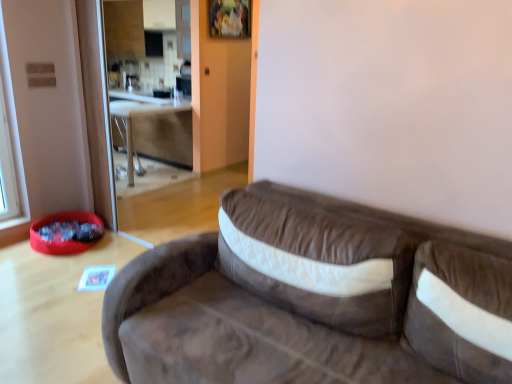
Question: From a real-world perspective, is brown suede studio couch at center on wooden table at center?

Choices:
 (A) no
 (B) yes

Answer: (B)

Question: Is brown suede studio couch at center turned away from wooden table at center?

Choices:
 (A) no
 (B) yes

Answer: (A)

Question: Does brown suede studio couch at center lie behind wooden table at center?

Choices:
 (A) yes
 (B) no

Answer: (B)

Question: Is brown suede studio couch at center closer to camera compared to wooden table at center?

Choices:
 (A) yes
 (B) no

Answer: (A)

Question: Is brown suede studio couch at center positioned far away from wooden table at center?

Choices:
 (A) yes
 (B) no

Answer: (A)

Question: Considering the relative sizes of brown suede studio couch at center and wooden table at center in the image provided, is brown suede studio couch at center thinner than wooden table at center?

Choices:
 (A) no
 (B) yes

Answer: (A)

Question: From the image's perspective, does wooden table at center appear higher than brown suede studio couch at center?

Choices:
 (A) yes
 (B) no

Answer: (A)

Question: Does wooden table at center have a greater width compared to brown suede studio couch at center?

Choices:
 (A) yes
 (B) no

Answer: (B)

Question: Is wooden table at center bigger than brown suede studio couch at center?

Choices:
 (A) no
 (B) yes

Answer: (A)

Question: From the image's perspective, is wooden table at center beneath brown suede studio couch at center?

Choices:
 (A) no
 (B) yes

Answer: (A)

Question: From a real-world perspective, is wooden table at center beneath brown suede studio couch at center?

Choices:
 (A) no
 (B) yes

Answer: (B)

Question: Is wooden table at center thinner than brown suede studio couch at center?

Choices:
 (A) yes
 (B) no

Answer: (A)

Question: From the image's perspective, relative to brown suede studio couch at center, is wooden table at center above or below?

Choices:
 (A) above
 (B) below

Answer: (A)